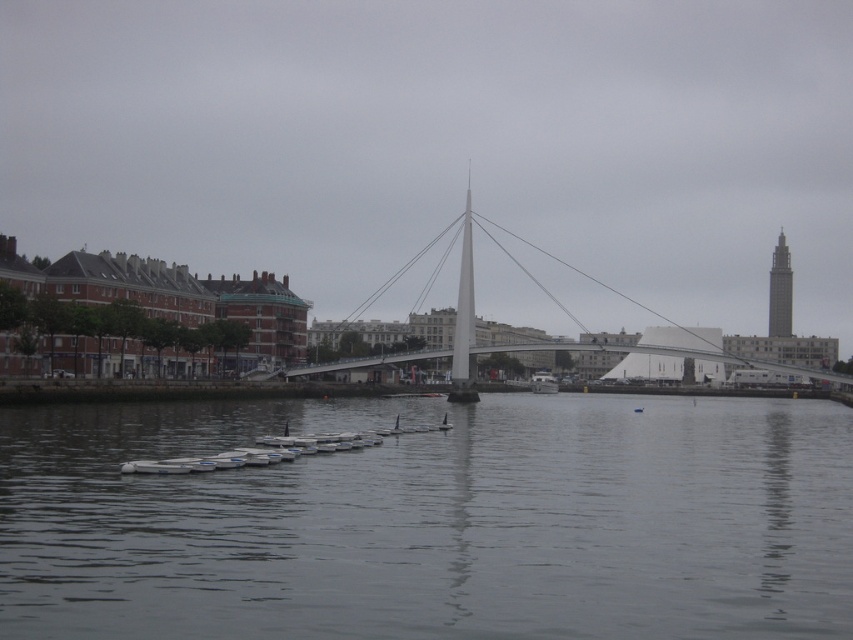
Which is more to the left, white plastic boats at center or white plastic boat at center?

From the viewer's perspective, white plastic boats at center appears more on the left side.

The image size is (853, 640). I want to click on white plastic boats at center, so click(x=277, y=449).

Does white metallic suspension bridge at center come in front of white plastic boat at center?

That is True.

Is point (714, 346) positioned after point (546, 387)?

Yes, point (714, 346) is farther from viewer.

Does point (560, 348) lie behind point (540, 388)?

No, it is in front of (540, 388).

At what (x,y) coordinates should I click in order to perform the action: click on white metallic suspension bridge at center. Please return your answer as a coordinate pair (x, y). The width and height of the screenshot is (853, 640). Looking at the image, I should click on (548, 298).

Does gray matte water at center have a larger size compared to smooth gray tower at right?

Incorrect, gray matte water at center is not larger than smooth gray tower at right.

From the picture: Is gray matte water at center taller than smooth gray tower at right?

No, gray matte water at center is not taller than smooth gray tower at right.

Is point (554, 452) positioned in front of point (775, 296)?

Yes, point (554, 452) is closer to viewer.

The width and height of the screenshot is (853, 640). I want to click on gray matte water at center, so click(433, 522).